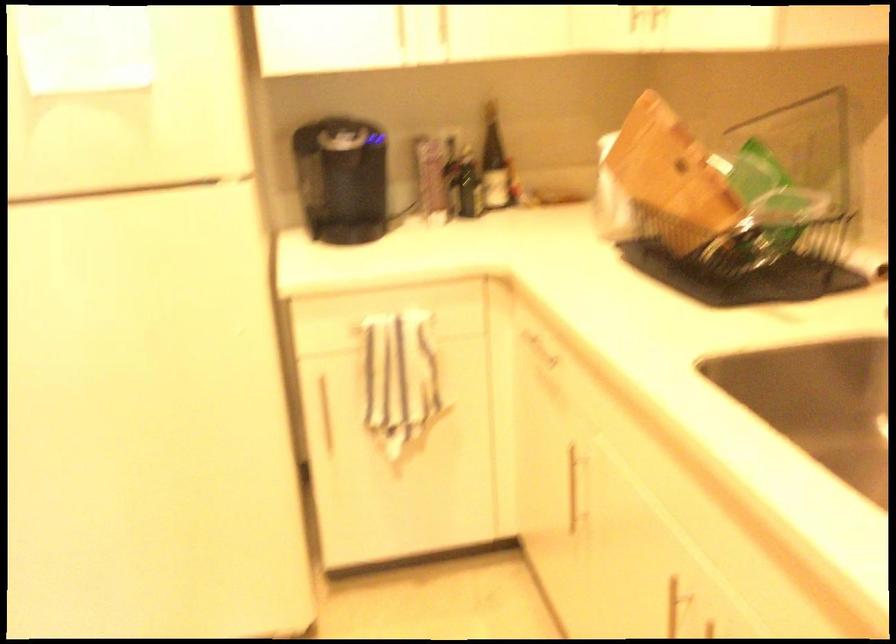
Find where to lift the wooden knife block. Please return your answer as a coordinate pair (x, y).

(670, 167)